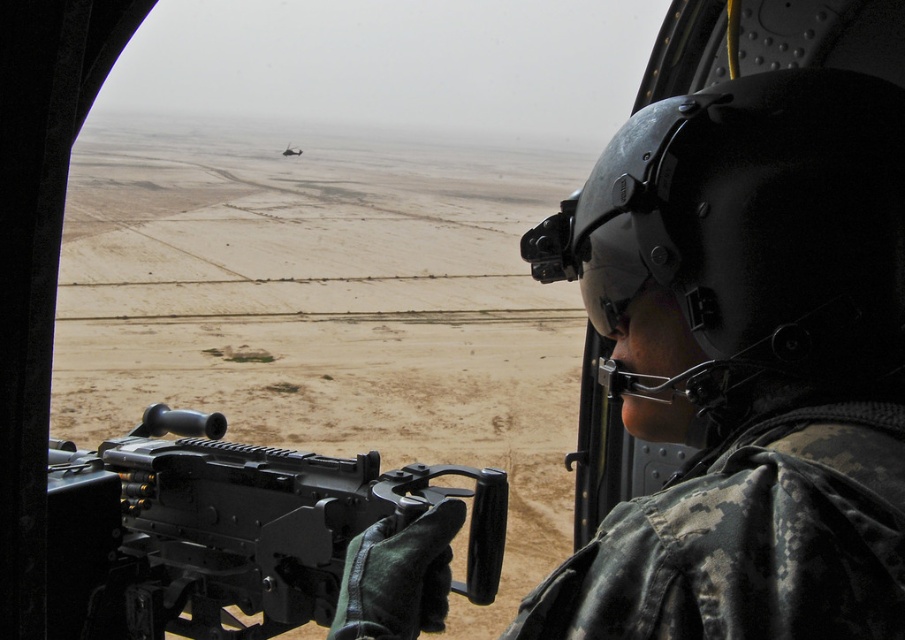
This screenshot has height=640, width=905. What do you see at coordinates (233, 529) in the screenshot?
I see `black matte rifle at center` at bounding box center [233, 529].

Which of these two, black matte rifle at center or dark gray metallic helicopter at upper center, stands shorter?

With less height is black matte rifle at center.

The image size is (905, 640). I want to click on black matte rifle at center, so click(x=233, y=529).